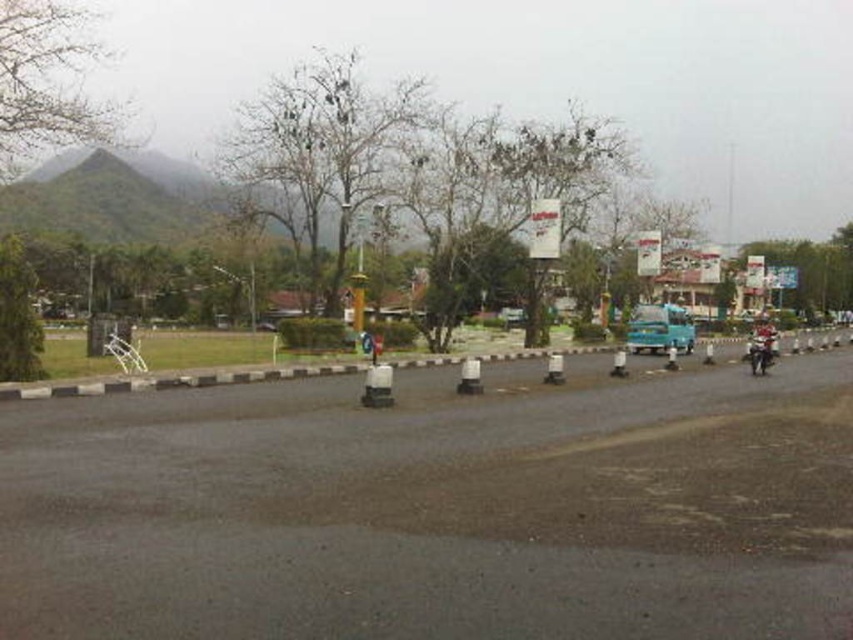
Question: Which of the following is the farthest from the observer?

Choices:
 (A) (648, 323)
 (B) (759, 336)

Answer: (A)

Question: Can you confirm if blue matte truck at center is positioned above shiny silver motorcycle at right?

Choices:
 (A) yes
 (B) no

Answer: (A)

Question: Observing the image, what is the correct spatial positioning of blue matte truck at center in reference to shiny silver motorcycle at right?

Choices:
 (A) left
 (B) right

Answer: (A)

Question: Which object is farther from the camera taking this photo?

Choices:
 (A) blue matte truck at center
 (B) shiny silver motorcycle at right

Answer: (A)

Question: Is blue matte truck at center thinner than shiny silver motorcycle at right?

Choices:
 (A) no
 (B) yes

Answer: (A)